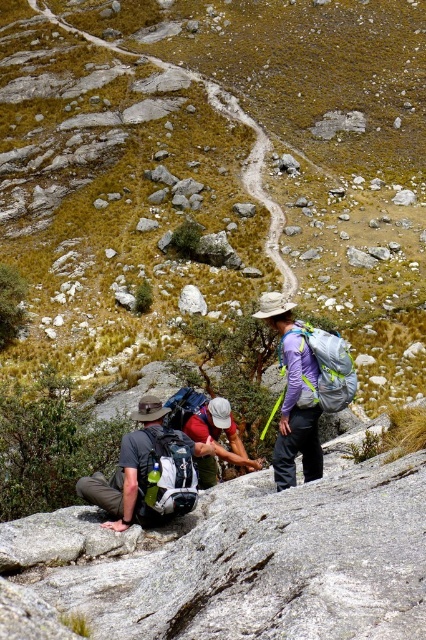
Question: Which is farther from the grassy hillside at upper center?

Choices:
 (A) white smooth rock at center
 (B) matte gray backpack at lower left

Answer: (B)

Question: Is grassy hillside at upper center to the left of white smooth rock at center from the viewer's perspective?

Choices:
 (A) yes
 (B) no

Answer: (B)

Question: Among these points, which one is farthest from the camera?

Choices:
 (A) (172, 461)
 (B) (278, 138)
 (C) (192, 285)

Answer: (B)

Question: Which object appears closest to the camera in this image?

Choices:
 (A) white smooth rock at center
 (B) grassy hillside at upper center

Answer: (B)

Question: Is grassy hillside at upper center thinner than matte gray backpack at lower left?

Choices:
 (A) no
 (B) yes

Answer: (A)

Question: Is grassy hillside at upper center thinner than white smooth rock at center?

Choices:
 (A) yes
 (B) no

Answer: (B)